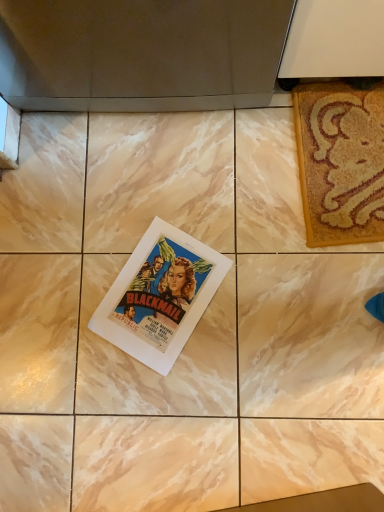
The height and width of the screenshot is (512, 384). I want to click on white paper at center, so click(160, 295).

What do you see at coordinates (160, 295) in the screenshot? Image resolution: width=384 pixels, height=512 pixels. I see `white paper at center` at bounding box center [160, 295].

Locate an element on the screen. The width and height of the screenshot is (384, 512). white paper at center is located at coordinates (160, 295).